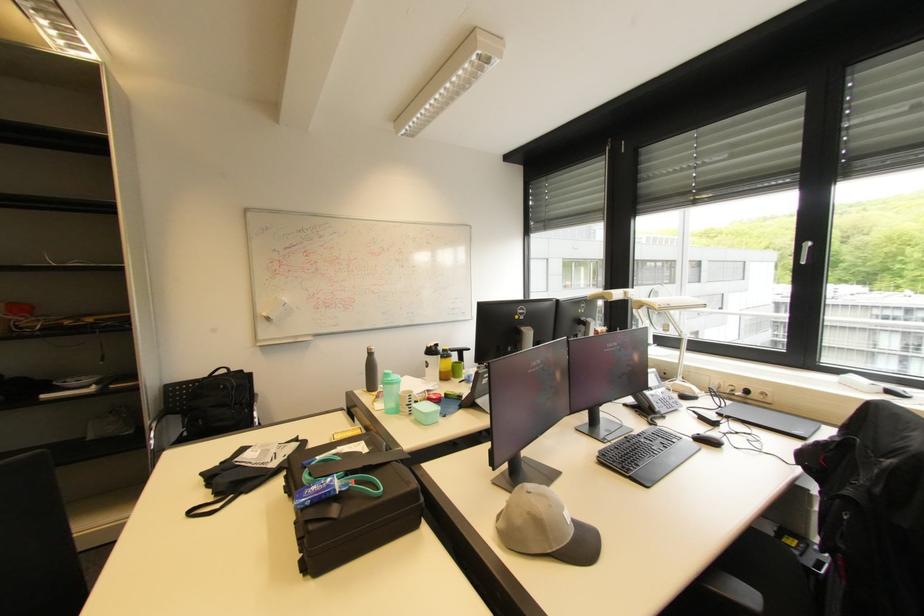
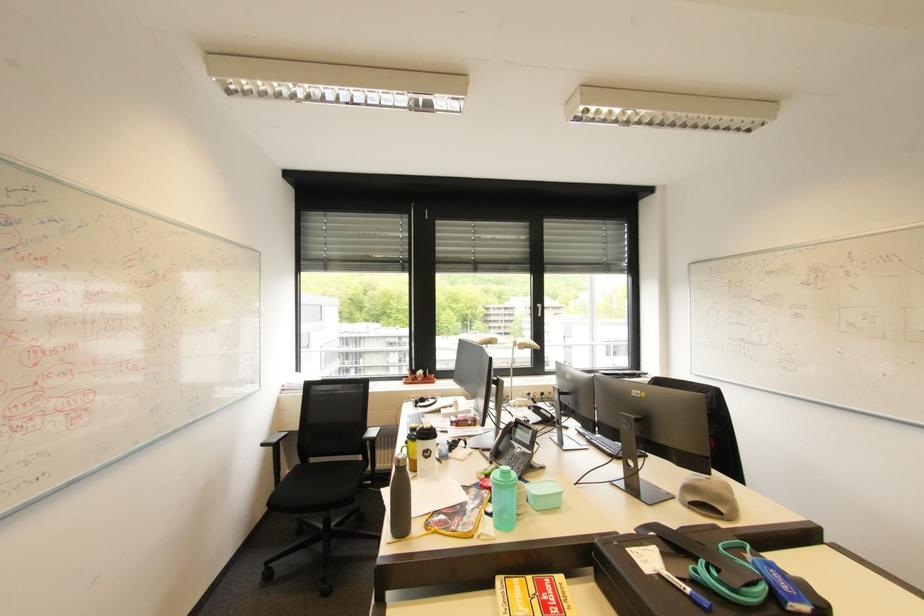
Locate, in the second image, the point that corresponds to pixel 394 379 in the first image.

(517, 477)